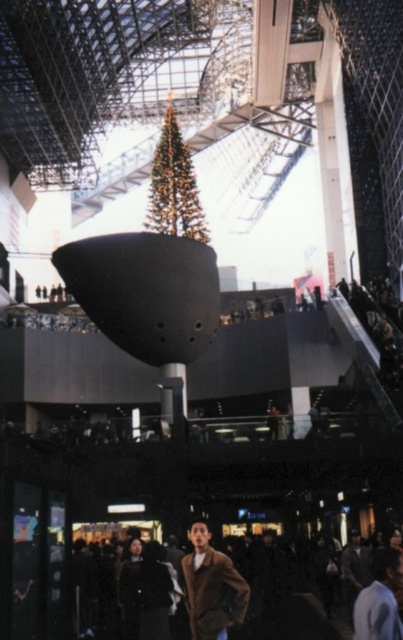
Question: Estimate the real-world distances between objects in this image. Which object is closer to the green textured christmas tree at center?

Choices:
 (A) dark brown leather jacket at lower center
 (B) brown wool coat at lower center

Answer: (B)

Question: Which object appears closest to the camera in this image?

Choices:
 (A) brown wool coat at lower center
 (B) dark brown leather jacket at lower center
 (C) green textured christmas tree at center

Answer: (B)

Question: Is brown wool coat at lower center to the left of dark brown leather jacket at lower center from the viewer's perspective?

Choices:
 (A) yes
 (B) no

Answer: (A)

Question: Observing the image, what is the correct spatial positioning of brown wool coat at lower center in reference to dark brown leather jacket at lower center?

Choices:
 (A) below
 (B) above

Answer: (A)

Question: From the image, what is the correct spatial relationship of green textured christmas tree at center in relation to dark brown leather jacket at lower center?

Choices:
 (A) right
 (B) left

Answer: (B)

Question: Which of the following is the closest to the observer?

Choices:
 (A) green textured christmas tree at center
 (B) brown wool coat at lower center
 (C) dark brown leather jacket at lower center

Answer: (C)